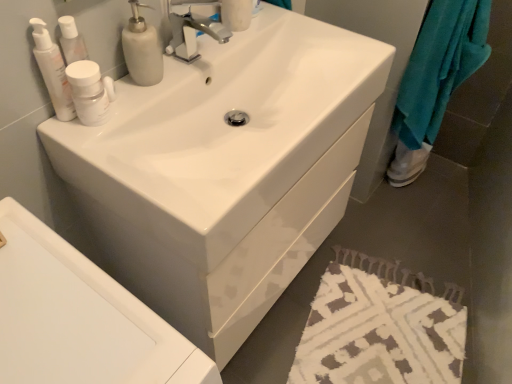
Find the location of a particular element. Image resolution: width=512 pixels, height=384 pixels. vacant region to the right of white glossy bottle at upper left, the second mouthwash viewed from the right is located at coordinates click(142, 107).